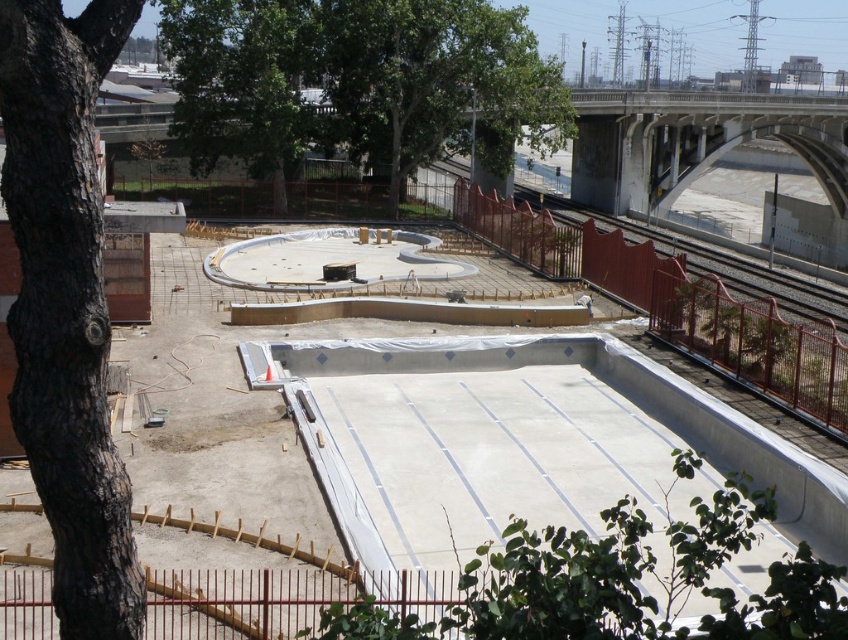
Between point (37, 268) and point (477, 56), which one is positioned in front?

Positioned in front is point (37, 268).

Is black rough bark tree at left behind green leafy tree at upper center?

No, black rough bark tree at left is closer to the viewer.

Is point (28, 38) closer to viewer compared to point (274, 148)?

Yes, it is.

At what (x,y) coordinates should I click in order to perform the action: click on black rough bark tree at left. Please return your answer as a coordinate pair (x, y). Looking at the image, I should click on (65, 305).